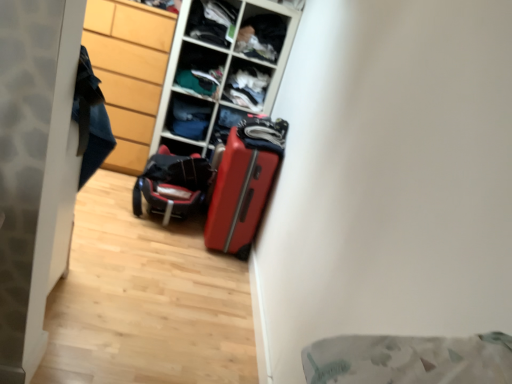
Question: Which direction should I rotate to look at dark fabric clothes at upper center, positioned as the 4th shelf in bottom-to-top order?

Choices:
 (A) right
 (B) left

Answer: (A)

Question: Can you confirm if matte plastic shelf at upper center, the 1th shelf in the top-to-bottom sequence, is positioned to the right of matte plastic cabinet at center?

Choices:
 (A) yes
 (B) no

Answer: (B)

Question: From a real-world perspective, is matte plastic shelf at upper center, the 5th shelf ordered from the bottom, below matte plastic cabinet at center?

Choices:
 (A) no
 (B) yes

Answer: (A)

Question: Is matte plastic shelf at upper center, the 5th shelf ordered from the bottom, directly adjacent to matte plastic cabinet at center?

Choices:
 (A) yes
 (B) no

Answer: (B)

Question: From the image's perspective, would you say matte plastic shelf at upper center, the 5th shelf ordered from the bottom, is shown under matte plastic cabinet at center?

Choices:
 (A) yes
 (B) no

Answer: (B)

Question: Considering the relative sizes of matte plastic shelf at upper center, the 5th shelf ordered from the bottom, and matte plastic cabinet at center in the image provided, is matte plastic shelf at upper center, the 5th shelf ordered from the bottom, thinner than matte plastic cabinet at center?

Choices:
 (A) yes
 (B) no

Answer: (A)

Question: Can you confirm if matte plastic shelf at upper center, the 5th shelf ordered from the bottom, is wider than matte plastic cabinet at center?

Choices:
 (A) yes
 (B) no

Answer: (B)

Question: Is the surface of shiny red suitcase at center in direct contact with black textured suitcase at center?

Choices:
 (A) no
 (B) yes

Answer: (A)

Question: Is shiny red suitcase at center closer to the viewer compared to black textured suitcase at center?

Choices:
 (A) no
 (B) yes

Answer: (B)

Question: Can you confirm if shiny red suitcase at center is shorter than black textured suitcase at center?

Choices:
 (A) no
 (B) yes

Answer: (A)

Question: From a real-world perspective, is shiny red suitcase at center located beneath black textured suitcase at center?

Choices:
 (A) yes
 (B) no

Answer: (B)

Question: Does shiny red suitcase at center appear on the right side of black textured suitcase at center?

Choices:
 (A) yes
 (B) no

Answer: (A)

Question: From a real-world perspective, is shiny red suitcase at center physically above black textured suitcase at center?

Choices:
 (A) no
 (B) yes

Answer: (B)

Question: Does dark fabric clothes at upper center, positioned as the 4th shelf in bottom-to-top order, have a lesser width compared to wooden cabinet at left?

Choices:
 (A) yes
 (B) no

Answer: (A)